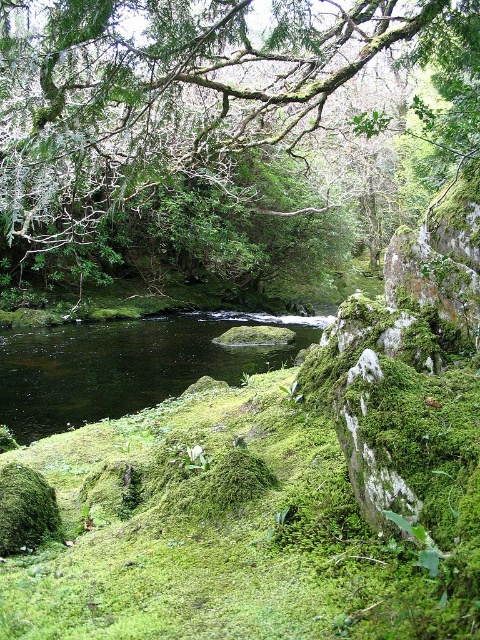
Question: Which point is closer to the camera?

Choices:
 (A) (12, 170)
 (B) (15, 358)

Answer: (A)

Question: Which object is the closest to the black liquid water at center?

Choices:
 (A) green mossy rock at lower left
 (B) green mossy branch at upper center

Answer: (B)

Question: Which point is farther from the camera taking this photo?

Choices:
 (A) (40, 500)
 (B) (72, 186)

Answer: (B)

Question: In this image, where is black liquid water at center located relative to green mossy rock at lower left?

Choices:
 (A) below
 (B) above

Answer: (B)

Question: Is black liquid water at center to the left of green mossy rock at lower left from the viewer's perspective?

Choices:
 (A) no
 (B) yes

Answer: (B)

Question: Does green mossy branch at upper center appear over black liquid water at center?

Choices:
 (A) no
 (B) yes

Answer: (B)